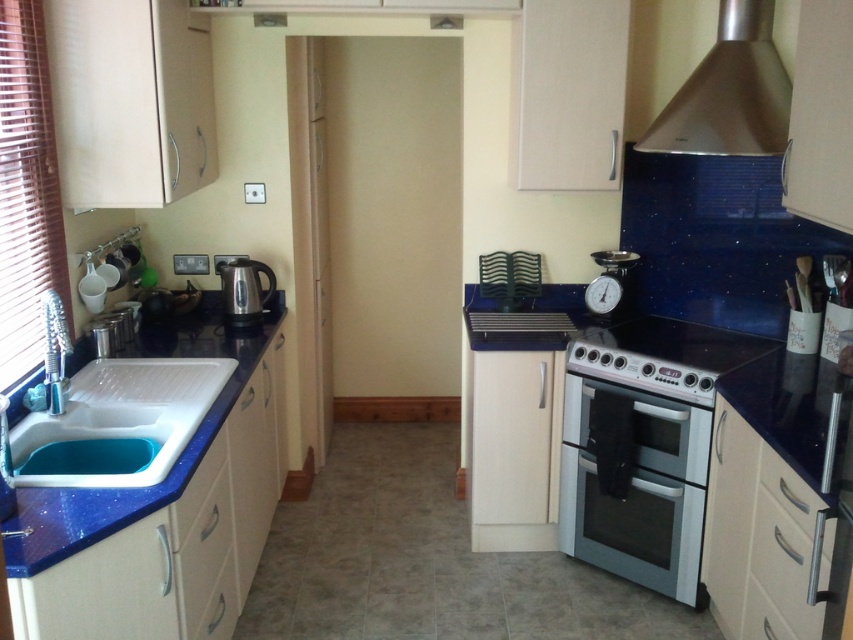
You are a delivery person who needs to place a 2.0 meter long package horizontally between the white glossy sink at left and the stainless steel exhaust hood at upper right. Is there enough space for the package to fit horizontally between them?

The distance between the white glossy sink at left and the stainless steel exhaust hood at upper right is 1.96 meters. Since the package is 2.0 meters long, it is slightly longer than the available space. Therefore, the package cannot fit horizontally between them.

You are a kitchen designer assessing the layout. Which object, the white glossy sink at left or the stainless steel exhaust hood at upper right, is taller?

The stainless steel exhaust hood at upper right is taller than the white glossy sink at left.